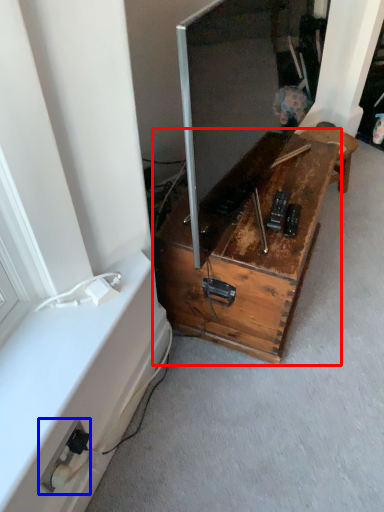
Question: Among these objects, which one is nearest to the camera, furniture (highlighted by a red box) or electric outlet (highlighted by a blue box)?

Choices:
 (A) furniture
 (B) electric outlet

Answer: (B)